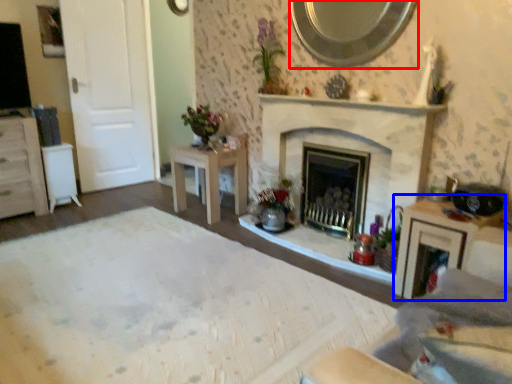
Question: Which object appears farthest to the camera in this image, mirror (highlighted by a red box) or vanity (highlighted by a blue box)?

Choices:
 (A) mirror
 (B) vanity

Answer: (A)